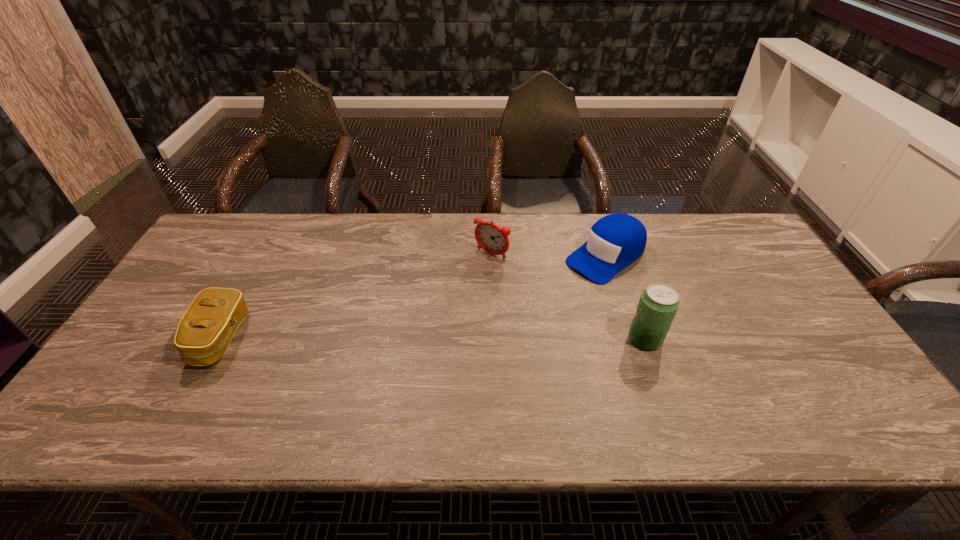
The width and height of the screenshot is (960, 540). I want to click on vacant region located on the front-facing side of the baseball cap, so click(525, 313).

The image size is (960, 540). Identify the location of free location located 0.070m on the front-facing side of the second object from left to right. (470, 274).

You are a GUI agent. You are given a task and a screenshot of the screen. Output one action in this format:
    pyautogui.click(x=<x>, y=<y>)
    Task: Click on the free location located on the front-facing side of the second object from left to right
    
    Given the screenshot: What is the action you would take?
    pyautogui.click(x=409, y=342)

Locate an element on the screen. The width and height of the screenshot is (960, 540). free space located on the front-facing side of the second object from left to right is located at coordinates (422, 326).

You are a GUI agent. You are given a task and a screenshot of the screen. Output one action in this format:
    pyautogui.click(x=<x>, y=<y>)
    Task: Click on the baseball cap located in the far edge section of the desktop
    The height and width of the screenshot is (540, 960).
    Given the screenshot: What is the action you would take?
    pyautogui.click(x=615, y=241)

You are a GUI agent. You are given a task and a screenshot of the screen. Output one action in this format:
    pyautogui.click(x=<x>, y=<y>)
    Task: Click on the alarm clock that is positioned at the far edge
    
    Given the screenshot: What is the action you would take?
    pyautogui.click(x=493, y=239)

Find the location of a particular element. object situated at the near edge is located at coordinates (204, 333).

I want to click on object positioned at the left edge, so click(x=204, y=333).

Locate an element on the screen. The image size is (960, 540). object that is positioned at the near left corner is located at coordinates (204, 333).

Identify the location of blank space at the far edge of the desktop. This screenshot has height=540, width=960. [x=300, y=217].